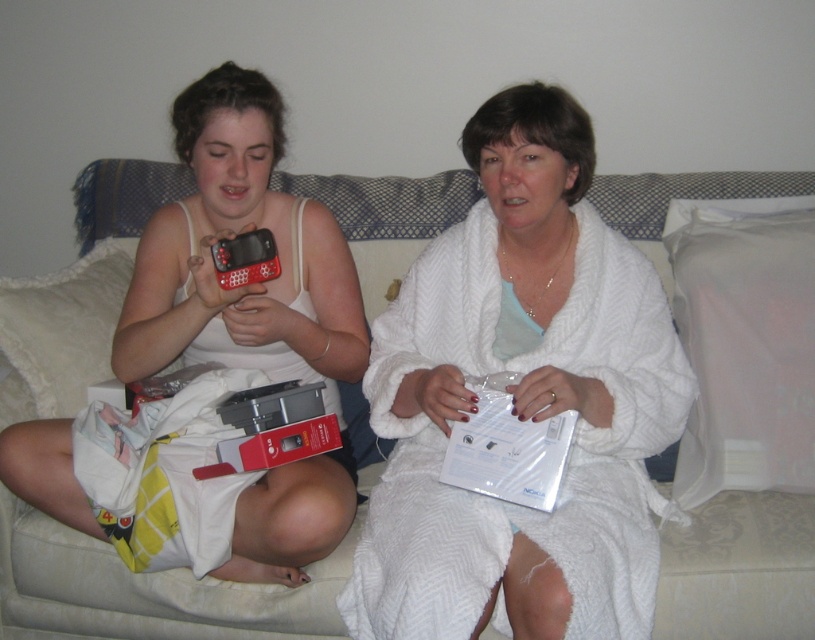
You are designing a living room layout and need to place a rectangular coffee table between the white fluffy robe at center and the beige fabric couch at center. Given their widths, which object should the coffee table be closer to?

The coffee table should be closer to the beige fabric couch at center because the white fluffy robe at center has a smaller width, meaning the couch occupies more space and likely requires more clearance.

You are planning to place a new phone on the beige fabric couch at center. Considering the size of the matte black phone at center, will it fit comfortably without overcrowding the space?

The beige fabric couch at center has a larger size compared to the matte black phone at center, so the phone will fit comfortably without overcrowding the space.